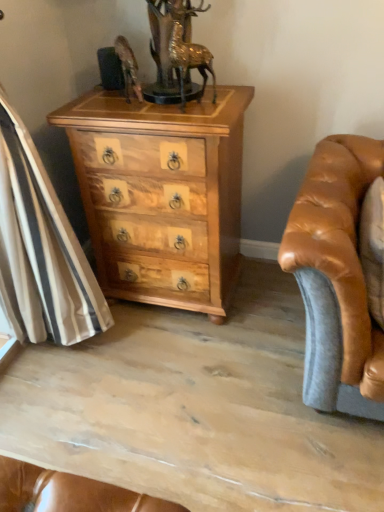
Question: Are gold metallic deer at upper center and natural wood chest of drawers at center far apart?

Choices:
 (A) yes
 (B) no

Answer: (B)

Question: From a real-world perspective, is gold metallic deer at upper center on natural wood chest of drawers at center?

Choices:
 (A) yes
 (B) no

Answer: (A)

Question: Is gold metallic deer at upper center bigger than natural wood chest of drawers at center?

Choices:
 (A) yes
 (B) no

Answer: (B)

Question: Does gold metallic deer at upper center appear on the left side of natural wood chest of drawers at center?

Choices:
 (A) no
 (B) yes

Answer: (A)

Question: Considering the relative sizes of gold metallic deer at upper center and natural wood chest of drawers at center in the image provided, is gold metallic deer at upper center shorter than natural wood chest of drawers at center?

Choices:
 (A) yes
 (B) no

Answer: (A)

Question: Considering the relative positions of gold metallic deer at upper center and natural wood chest of drawers at center in the image provided, is gold metallic deer at upper center behind natural wood chest of drawers at center?

Choices:
 (A) no
 (B) yes

Answer: (A)

Question: From a real-world perspective, is natural wood chest of drawers at center positioned under gold metallic deer at upper center based on gravity?

Choices:
 (A) no
 (B) yes

Answer: (B)

Question: Does natural wood chest of drawers at center have a lesser width compared to gold metallic deer at upper center?

Choices:
 (A) no
 (B) yes

Answer: (A)

Question: Considering the relative positions of natural wood chest of drawers at center and gold metallic deer at upper center in the image provided, is natural wood chest of drawers at center to the left of gold metallic deer at upper center from the viewer's perspective?

Choices:
 (A) yes
 (B) no

Answer: (A)

Question: Does natural wood chest of drawers at center have a larger size compared to gold metallic deer at upper center?

Choices:
 (A) yes
 (B) no

Answer: (A)

Question: Is natural wood chest of drawers at center to the right of gold metallic deer at upper center from the viewer's perspective?

Choices:
 (A) no
 (B) yes

Answer: (A)

Question: Would you consider natural wood chest of drawers at center to be distant from gold metallic deer at upper center?

Choices:
 (A) no
 (B) yes

Answer: (A)

Question: From a real-world perspective, is natural wood chest of drawers at center above or below gold metallic deer at upper center?

Choices:
 (A) above
 (B) below

Answer: (B)